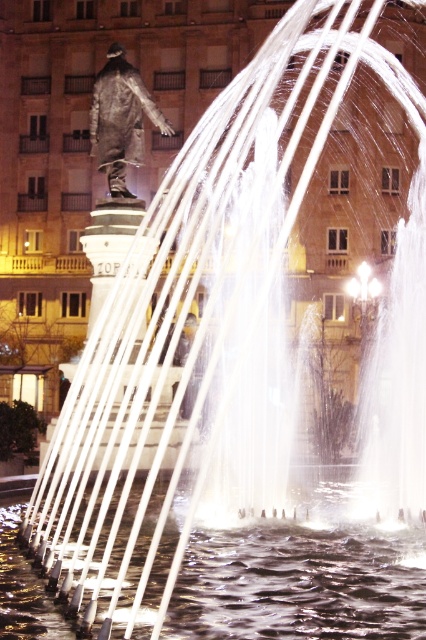
Does clear liquid water at center have a larger size compared to bronze statue at upper left?

Correct, clear liquid water at center is larger in size than bronze statue at upper left.

At what (x,y) coordinates should I click in order to perform the action: click on clear liquid water at center. Please return your answer as a coordinate pair (x, y). This screenshot has height=640, width=426. Looking at the image, I should click on (299, 584).